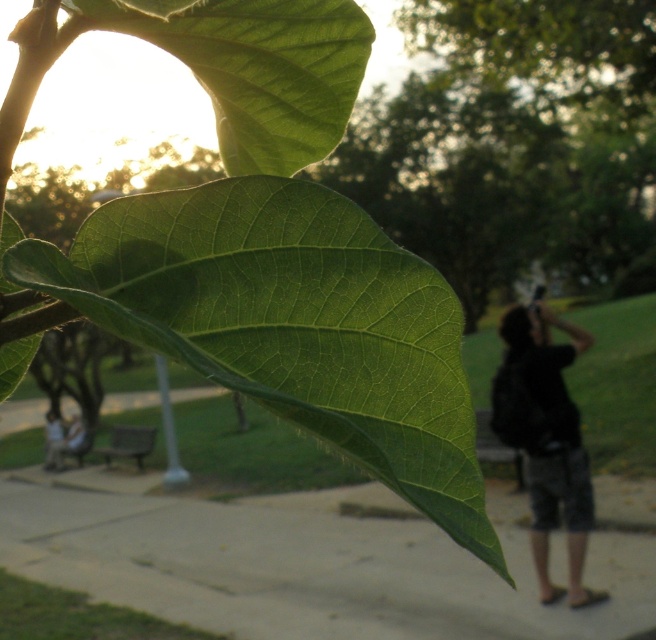
Can you confirm if green matte leaf at center is wider than dark gray cotton hoodie at right?

Incorrect, green matte leaf at center's width does not surpass dark gray cotton hoodie at right's.

Does green matte leaf at center have a greater height compared to dark gray cotton hoodie at right?

No, green matte leaf at center is not taller than dark gray cotton hoodie at right.

Identify the location of green matte leaf at center. (291, 324).

Does green matte leaf at center have a greater width compared to smooth concrete pavement at lower center?

In fact, green matte leaf at center might be narrower than smooth concrete pavement at lower center.

What do you see at coordinates (291, 324) in the screenshot? I see `green matte leaf at center` at bounding box center [291, 324].

Between point (239, 323) and point (9, 524), which one is positioned in front?

Point (239, 323)

Where is `green matte leaf at center`? The height and width of the screenshot is (640, 656). green matte leaf at center is located at coordinates (291, 324).

Does smooth concrete pavement at lower center have a greater height compared to dark gray cotton hoodie at right?

No, smooth concrete pavement at lower center is not taller than dark gray cotton hoodie at right.

Looking at this image, can you confirm if smooth concrete pavement at lower center is thinner than dark gray cotton hoodie at right?

Incorrect, smooth concrete pavement at lower center's width is not less than dark gray cotton hoodie at right's.

The height and width of the screenshot is (640, 656). What are the coordinates of `smooth concrete pavement at lower center` in the screenshot? It's located at (302, 566).

You are a GUI agent. You are given a task and a screenshot of the screen. Output one action in this format:
    pyautogui.click(x=<x>, y=<y>)
    Task: Click on the smooth concrete pavement at lower center
    Image resolution: width=656 pixels, height=640 pixels.
    Given the screenshot: What is the action you would take?
    pyautogui.click(x=302, y=566)